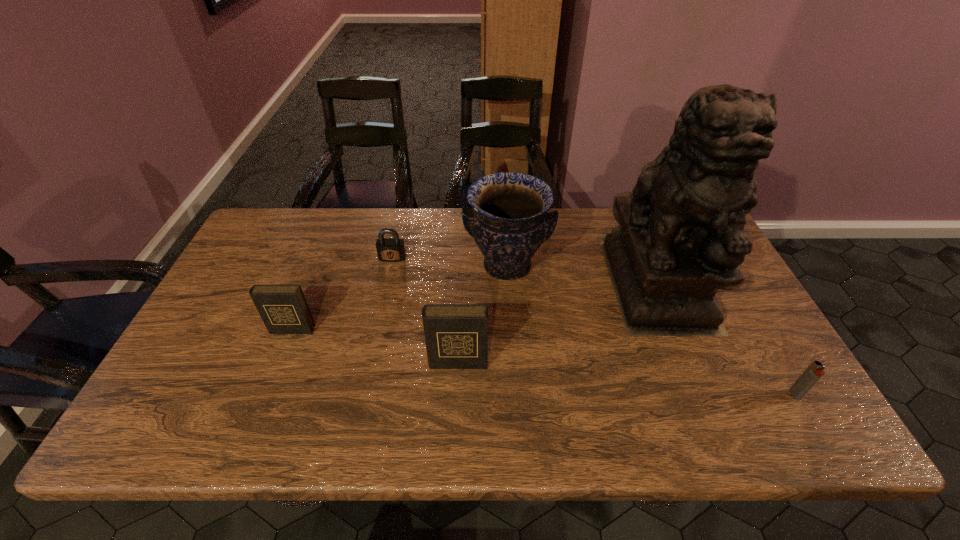
Where is `free area in between the shorter diary and the igniter`? This screenshot has height=540, width=960. free area in between the shorter diary and the igniter is located at coordinates (543, 362).

This screenshot has width=960, height=540. I want to click on free spot between the padlock and the leftmost object, so click(x=342, y=294).

I want to click on vacant point located between the second object from right to left and the third tallest object, so click(x=557, y=321).

Find the location of a particular element. free space between the sculpture and the rightmost object is located at coordinates (726, 338).

Where is `vacant space in between the fifth object from left to right and the second tallest object`? This screenshot has width=960, height=540. vacant space in between the fifth object from left to right and the second tallest object is located at coordinates (581, 273).

Point out which object is positioned as the third nearest to the rightmost object. Please provide its 2D coordinates. Your answer should be formatted as a tuple, i.e. [(x, y)], where the tuple contains the x and y coordinates of a point satisfying the conditions above.

[(456, 335)]

You are a GUI agent. You are given a task and a screenshot of the screen. Output one action in this format:
    pyautogui.click(x=<x>, y=<y>)
    Task: Click on the object that is the second closest to the padlock
    
    Given the screenshot: What is the action you would take?
    pyautogui.click(x=283, y=308)

At what (x,y) coordinates should I click in order to perform the action: click on vacant space that satisfies the following two spatial constraints: 1. on the front of the rightmost object near the keyhole; 2. on the left side of the fifth object from right to left. Please return your answer as a coordinate pair (x, y). Looking at the image, I should click on tap(363, 395).

Where is `vacant point that satisfies the following two spatial constraints: 1. on the front of the second object from left to right near the keyhole; 2. on the right side of the rightmost object`? vacant point that satisfies the following two spatial constraints: 1. on the front of the second object from left to right near the keyhole; 2. on the right side of the rightmost object is located at coordinates (363, 395).